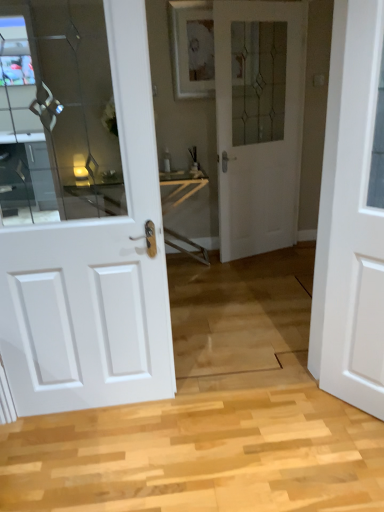
Question: Can white matte door at right, placed as the 1th door when sorted from front to back, be found inside white glossy door at left, the first door viewed from the left?

Choices:
 (A) no
 (B) yes

Answer: (A)

Question: Is white glossy door at left, which appears as the 3th door when viewed from the right, not inside white matte door at right, placed as the 1th door when sorted from front to back?

Choices:
 (A) yes
 (B) no

Answer: (A)

Question: Can you confirm if white glossy door at left, positioned as the second door in front-to-back order, is smaller than white matte door at right, marked as the first door in a right-to-left arrangement?

Choices:
 (A) yes
 (B) no

Answer: (B)

Question: Considering the relative sizes of white glossy door at left, the first door viewed from the left, and white matte door at right, placed as the 1th door when sorted from front to back, in the image provided, is white glossy door at left, the first door viewed from the left, thinner than white matte door at right, placed as the 1th door when sorted from front to back,?

Choices:
 (A) no
 (B) yes

Answer: (B)

Question: Does white glossy door at left, which appears as the 3th door when viewed from the right, have a greater height compared to white matte door at right, marked as the first door in a right-to-left arrangement?

Choices:
 (A) no
 (B) yes

Answer: (B)

Question: From a real-world perspective, relative to white glass door at center, the 1th door when ordered from back to front, is white matte door at right, marked as the 3th door in a left-to-right arrangement, vertically above or below?

Choices:
 (A) above
 (B) below

Answer: (B)

Question: From the image's perspective, is white matte door at right, marked as the first door in a right-to-left arrangement, above or below white glass door at center, the second door in the right-to-left sequence?

Choices:
 (A) above
 (B) below

Answer: (B)

Question: Considering the positions of white matte door at right, placed as the 1th door when sorted from front to back, and white glass door at center, the third door positioned from the front, in the image, is white matte door at right, placed as the 1th door when sorted from front to back, bigger or smaller than white glass door at center, the third door positioned from the front,?

Choices:
 (A) big
 (B) small

Answer: (B)

Question: Is white matte door at right, placed as the 1th door when sorted from front to back, inside or outside of white glass door at center, the 1th door when ordered from back to front?

Choices:
 (A) inside
 (B) outside

Answer: (B)

Question: From the image's perspective, is white matte door at right, marked as the 3th door in a left-to-right arrangement, located above or below white glossy door at left, which appears as the 3th door when viewed from the right?

Choices:
 (A) above
 (B) below

Answer: (B)

Question: Is point (380, 24) positioned closer to the camera than point (150, 186)?

Choices:
 (A) farther
 (B) closer

Answer: (B)

Question: From a real-world perspective, is white matte door at right, marked as the third door in a back-to-front arrangement, above or below white glossy door at left, which appears as the 3th door when viewed from the right?

Choices:
 (A) below
 (B) above

Answer: (A)

Question: Looking at their shapes, would you say white matte door at right, marked as the 3th door in a left-to-right arrangement, is wider or thinner than white glossy door at left, the first door viewed from the left?

Choices:
 (A) thin
 (B) wide

Answer: (B)

Question: Based on their sizes in the image, would you say white glass door at center, the third door positioned from the front, is bigger or smaller than white matte door at right, marked as the 3th door in a left-to-right arrangement?

Choices:
 (A) small
 (B) big

Answer: (B)

Question: From a real-world perspective, relative to white matte door at right, marked as the third door in a back-to-front arrangement, is white glass door at center, the 1th door when ordered from back to front, vertically above or below?

Choices:
 (A) below
 (B) above

Answer: (B)